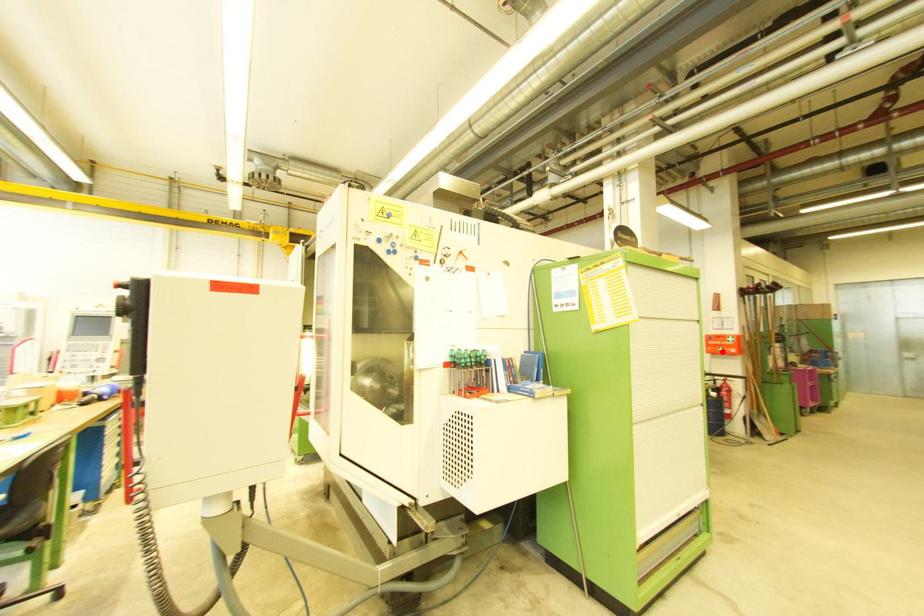
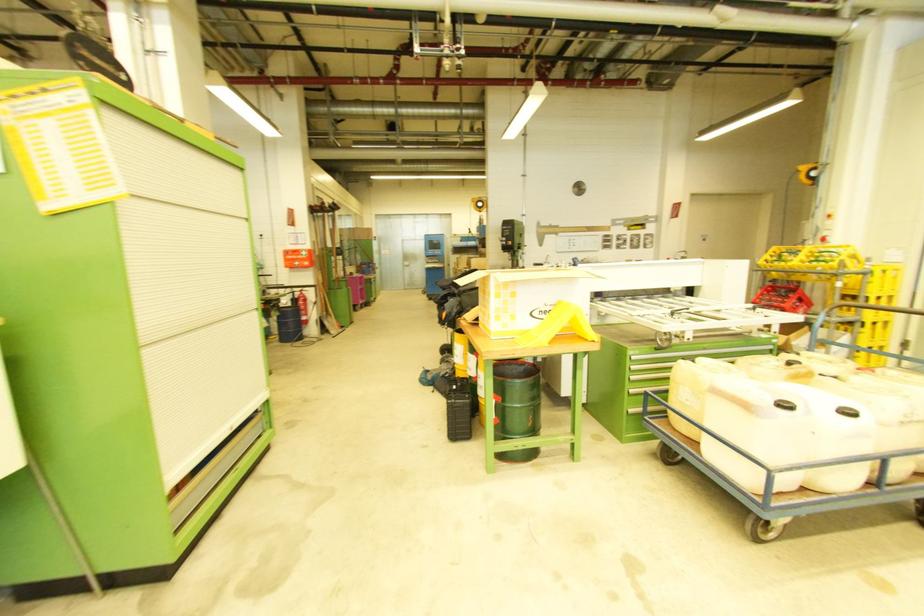
Locate, in the second image, the point that corresponds to the highlighted location in the first image.

(299, 265)